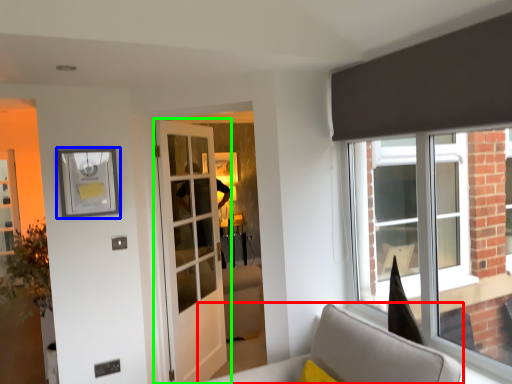
Question: Considering the real-world distances, which object is closest to furniture (highlighted by a red box)? picture frame (highlighted by a blue box) or door (highlighted by a green box).

Choices:
 (A) picture frame
 (B) door

Answer: (B)